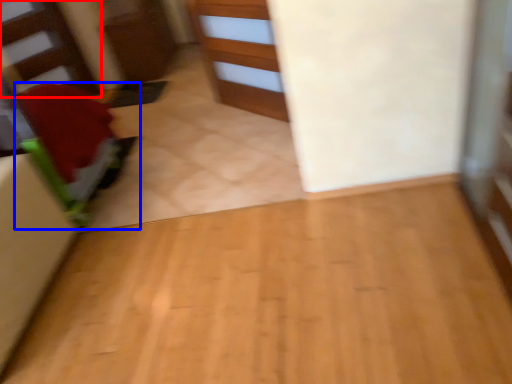
Question: Among these objects, which one is nearest to the camera, stairwell (highlighted by a red box) or furniture (highlighted by a blue box)?

Choices:
 (A) stairwell
 (B) furniture

Answer: (B)